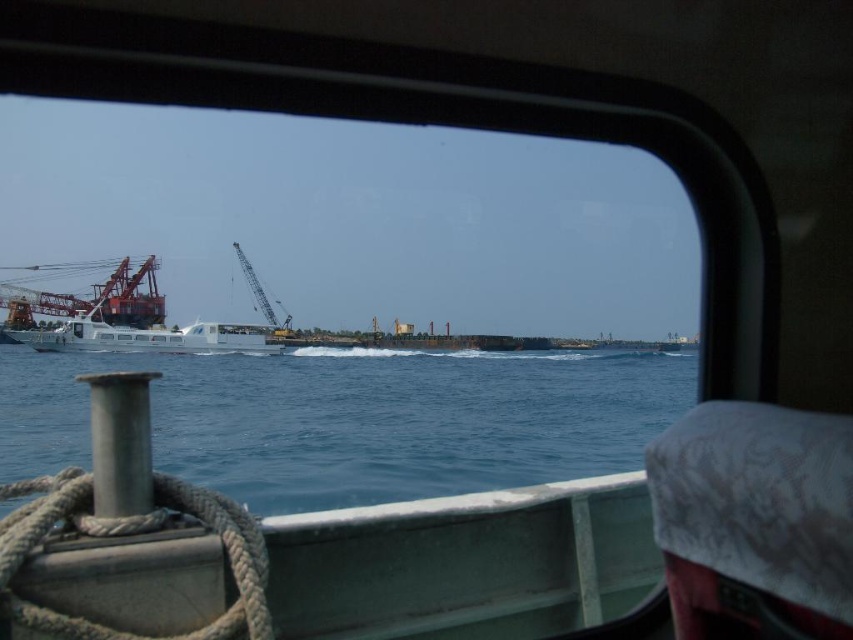
What do you see at coordinates (357, 419) in the screenshot? The height and width of the screenshot is (640, 853). I see `blue water at center` at bounding box center [357, 419].

Where is `blue water at center`? blue water at center is located at coordinates (357, 419).

Who is positioned more to the left, white glossy boat at left or orange metallic crane at left?

From the viewer's perspective, orange metallic crane at left appears more on the left side.

Does white glossy boat at left have a larger size compared to orange metallic crane at left?

Actually, white glossy boat at left might be smaller than orange metallic crane at left.

Describe the element at coordinates (149, 337) in the screenshot. This screenshot has height=640, width=853. I see `white glossy boat at left` at that location.

Identify the location of white glossy boat at left. The width and height of the screenshot is (853, 640). (149, 337).

Who is shorter, blue water at center or white matte rope at lower left?

white matte rope at lower left is shorter.

The height and width of the screenshot is (640, 853). Identify the location of blue water at center. (357, 419).